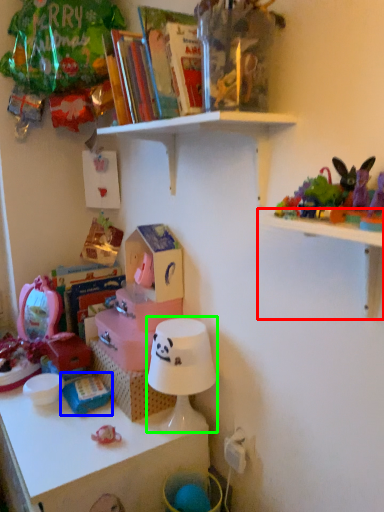
Question: Estimate the real-world distances between objects in this image. Which object is farther from shelf (highlighted by a red box), toy (highlighted by a blue box) or lamp (highlighted by a green box)?

Choices:
 (A) toy
 (B) lamp

Answer: (A)